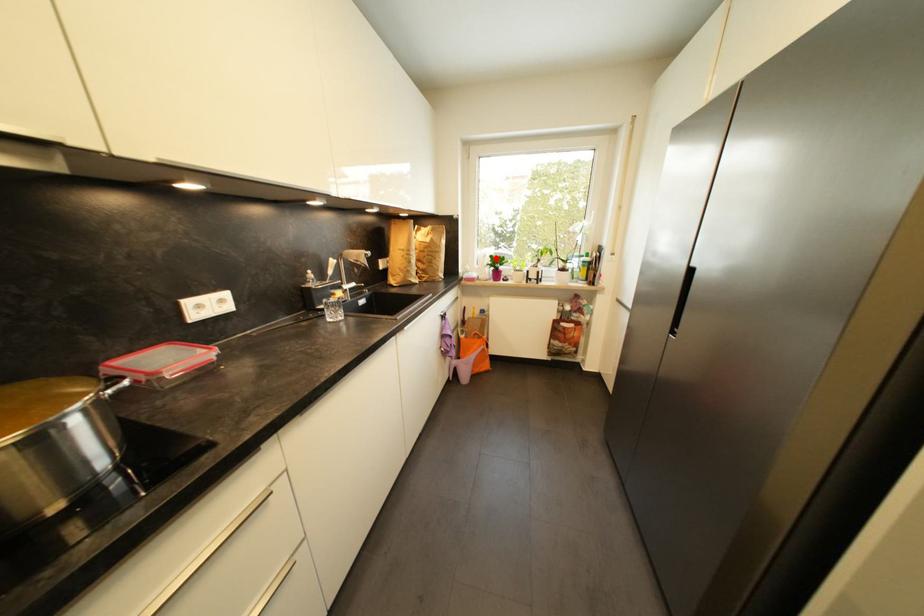
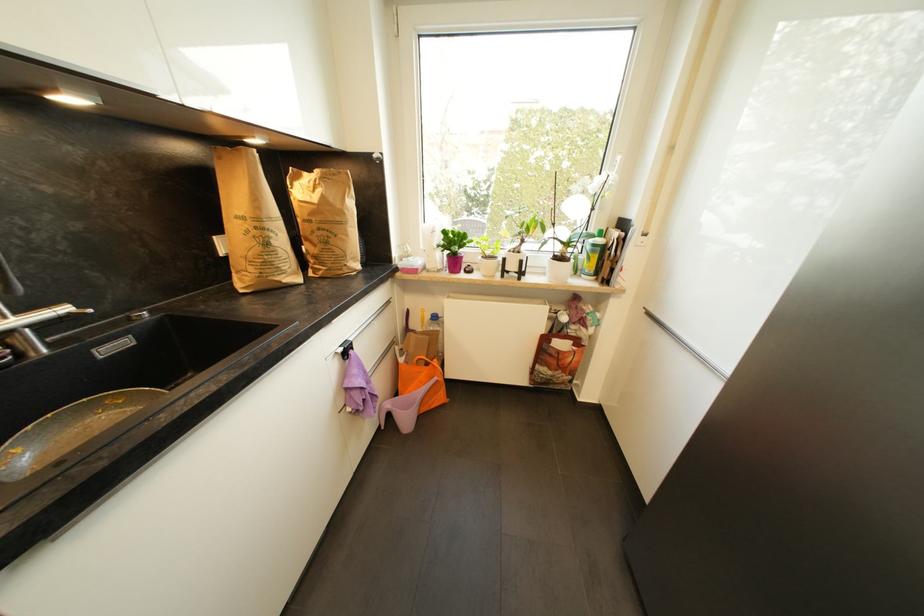
Where in the second image is the point corresponding to the highlighted location from the first image?

(450, 233)